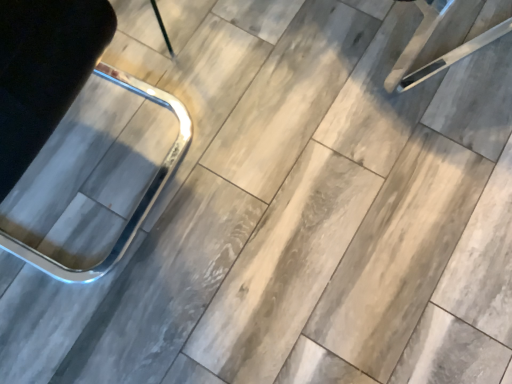
Image resolution: width=512 pixels, height=384 pixels. What do you see at coordinates (77, 140) in the screenshot?
I see `metallic chrome chair at left` at bounding box center [77, 140].

Where is `metallic chrome chair at left`? This screenshot has height=384, width=512. metallic chrome chair at left is located at coordinates (77, 140).

Find the location of a particular element. metallic chrome chair at left is located at coordinates (77, 140).